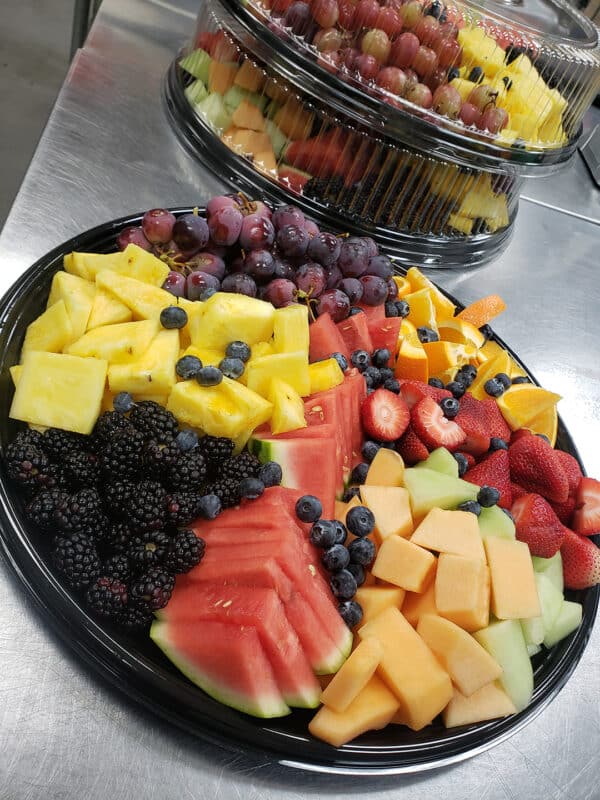
Image resolution: width=600 pixels, height=800 pixels. Find the location of `floor`. floor is located at coordinates (21, 84).